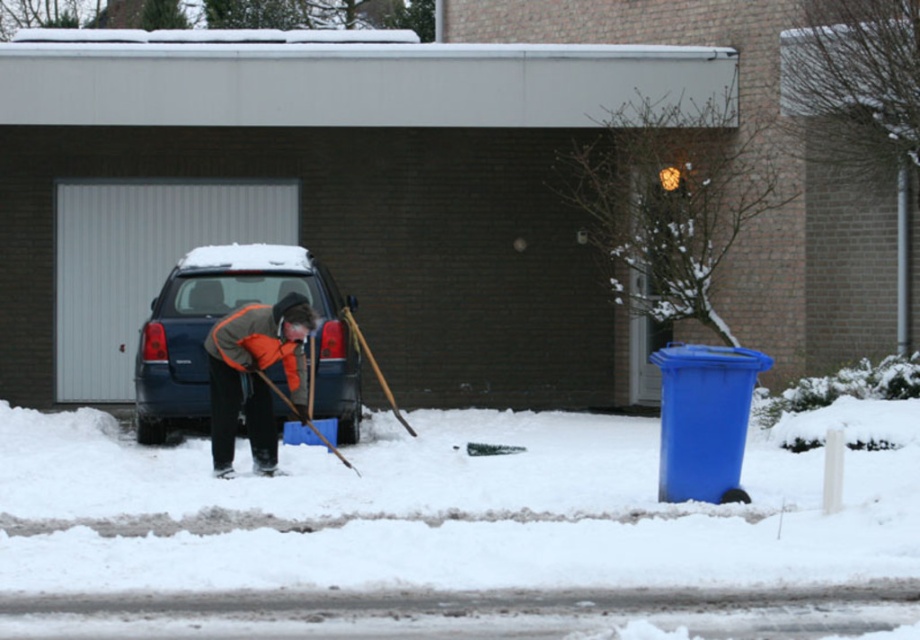
Which is more to the left, dark gray brick garage at center or orange fleece jacket at center?

dark gray brick garage at center is more to the left.

Looking at this image, is dark gray brick garage at center positioned before orange fleece jacket at center?

No, it is behind orange fleece jacket at center.

Between point (444, 84) and point (220, 355), which one is positioned in front?

Point (220, 355)

Where is `dark gray brick garage at center`? The image size is (920, 640). dark gray brick garage at center is located at coordinates (317, 195).

Does orange fleece jacket at center appear on the right side of wooden shovel at lower center?

No, orange fleece jacket at center is not to the right of wooden shovel at lower center.

Is point (234, 406) in front of point (322, 433)?

Yes, point (234, 406) is in front of point (322, 433).

The image size is (920, 640). What do you see at coordinates (254, 376) in the screenshot? I see `orange fleece jacket at center` at bounding box center [254, 376].

This screenshot has width=920, height=640. I want to click on orange fleece jacket at center, so click(x=254, y=376).

In the scene shown: Which is more to the left, dark gray brick garage at center or blue matte car at center?

Positioned to the left is dark gray brick garage at center.

Who is positioned more to the right, dark gray brick garage at center or blue matte car at center?

blue matte car at center

Is point (408, 145) positioned behind point (318, 284)?

Yes, point (408, 145) is farther from viewer.

Find the location of `dark gray brick garage at center`. dark gray brick garage at center is located at coordinates (317, 195).